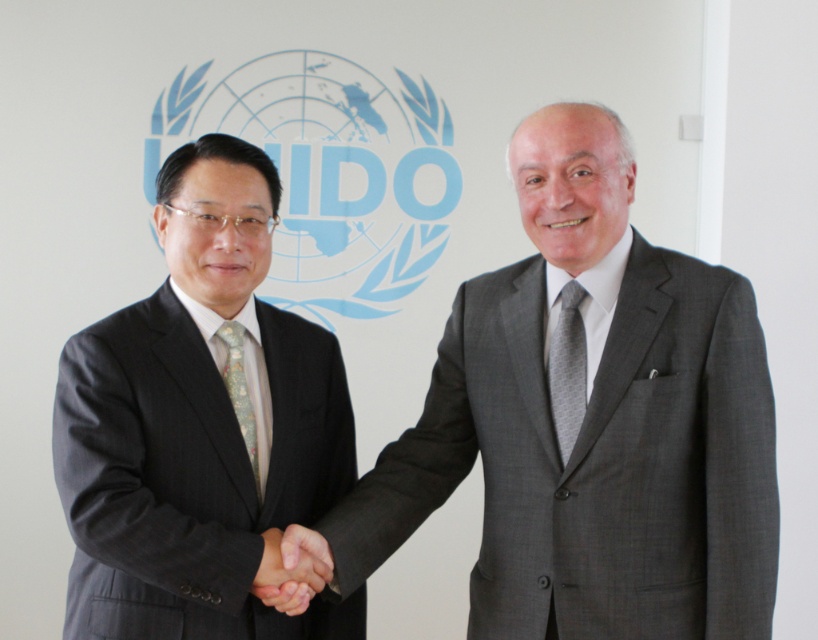
You are a photographer at an international conference. You need to capture a photo where the matte black suit at left stands out against the light blue floral silk tie at center. Given their sizes, which object should you focus on to ensure the subject is in the foreground?

The matte black suit at left is much taller than the light blue floral silk tie at center, so focusing on the matte black suit at left will place it in the foreground, making it stand out against the smaller light blue floral silk tie at center.

You are an event planner arranging seating for a conference. You need to seat the person in the gray textured suit at center and the person in the matte black suit at left at a table. Given their suits, which person requires a wider seat?

The gray textured suit at center requires a wider seat because its width is larger than the matte black suit at left.